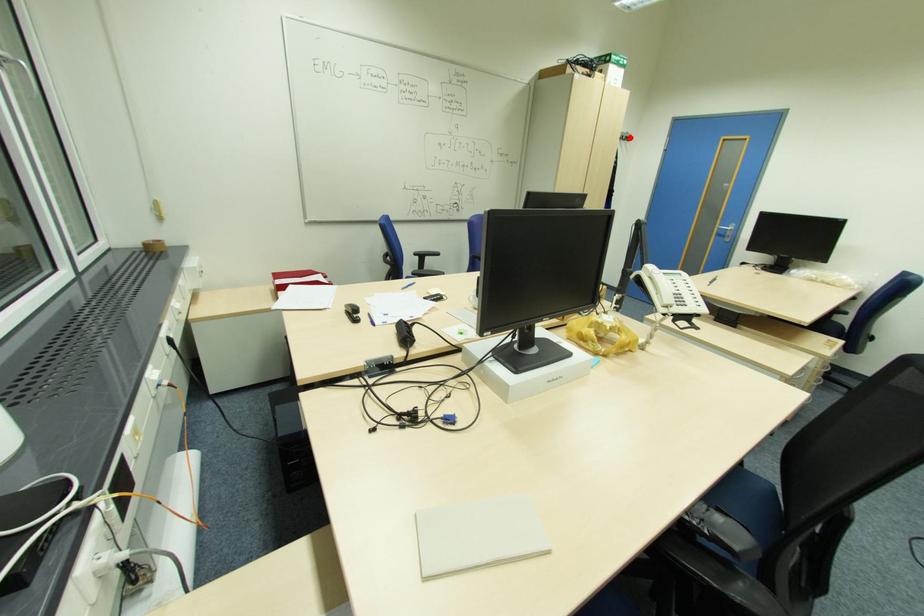
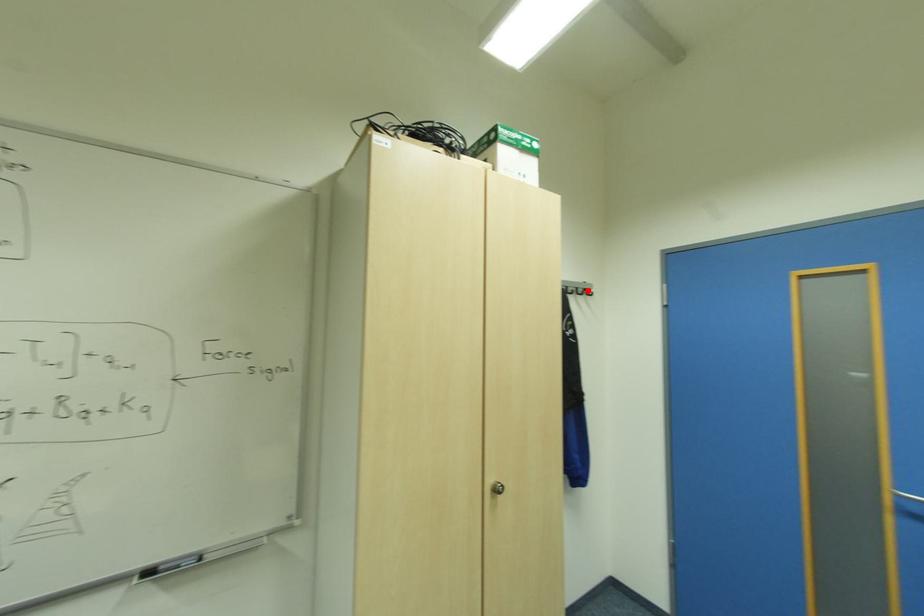
I am providing you with two images of the same scene from different viewpoints. A red point is marked on the first image and another point is marked on the second image. Is the marked point in image1 the same physical position as the marked point in image2?

Yes